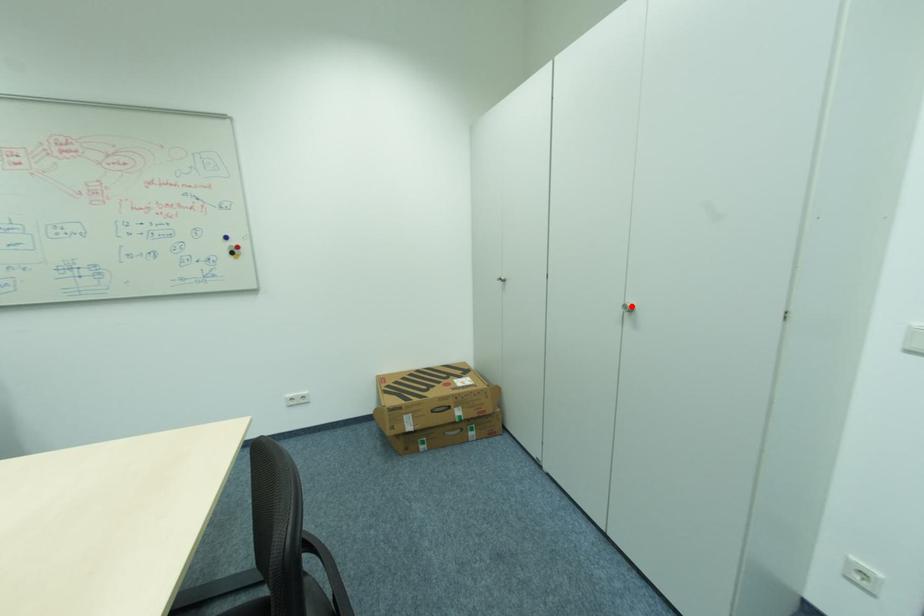
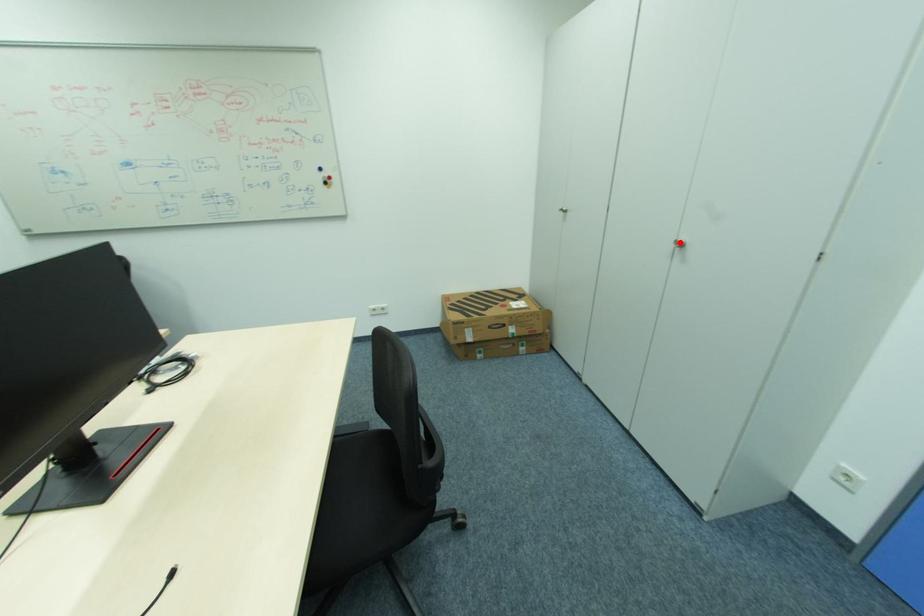
I am providing you with two images of the same scene from different viewpoints. A red point is marked on the first image and another point is marked on the second image. Do the highlighted points in image1 and image2 indicate the same real-world spot?

Yes